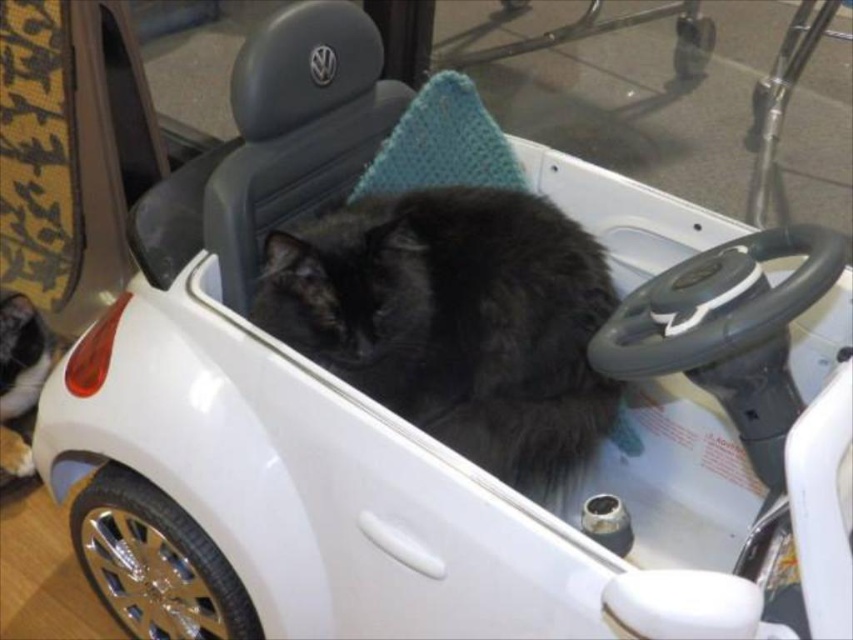
You are a parent looking for your two black cats in a room with a toy car. You see the black fluffy cat at center and the black fur cat at lower left. Which cat is sitting to the right of the other?

The black fluffy cat at center is positioned on the right side of black fur cat at lower left.

You are a photographer setting up for a pet photo shoot. You have two black cats in the scene, the black fluffy cat at center and the black fur cat at lower left. Which cat should you focus on to ensure it appears larger in the photo?

The black fluffy cat at center is closer to the viewer, so focusing on it will make it appear larger in the photo compared to the black fur cat at lower left.